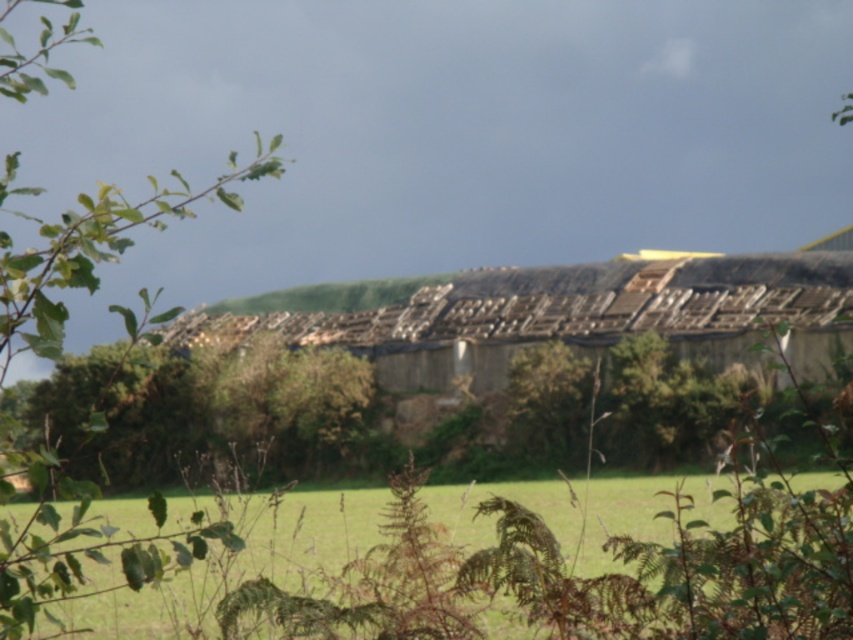
Question: Which point is farther to the camera?

Choices:
 (A) (102, 244)
 (B) (439, 612)

Answer: (B)

Question: In this image, where is green grass at lower center located relative to green leafy branch at left?

Choices:
 (A) above
 (B) below

Answer: (B)

Question: Which of the following is the closest to the observer?

Choices:
 (A) green grass at lower center
 (B) green leafy branch at left

Answer: (B)

Question: Is green grass at lower center below green leafy branch at left?

Choices:
 (A) yes
 (B) no

Answer: (A)

Question: Does green grass at lower center appear on the left side of green leafy branch at left?

Choices:
 (A) yes
 (B) no

Answer: (B)